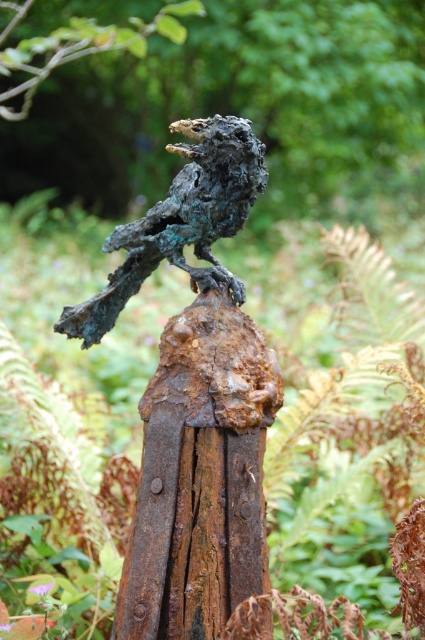
Question: Is rusty metal bird at upper center smaller than green patina bird at center?

Choices:
 (A) yes
 (B) no

Answer: (B)

Question: Which object is positioned closest to the rusty metal bird at center?

Choices:
 (A) green patina bird at center
 (B) rusty metal bird at upper center

Answer: (A)

Question: Is rusty metal bird at upper center wider than green patina bird at center?

Choices:
 (A) no
 (B) yes

Answer: (B)

Question: Is rusty metal bird at center further to camera compared to green patina bird at center?

Choices:
 (A) no
 (B) yes

Answer: (B)

Question: Which of the following is the farthest from the observer?

Choices:
 (A) rusty metal bird at center
 (B) rusty metal bird at upper center

Answer: (B)

Question: Considering the real-world distances, which object is farthest from the rusty metal bird at upper center?

Choices:
 (A) rusty metal bird at center
 (B) green patina bird at center

Answer: (A)